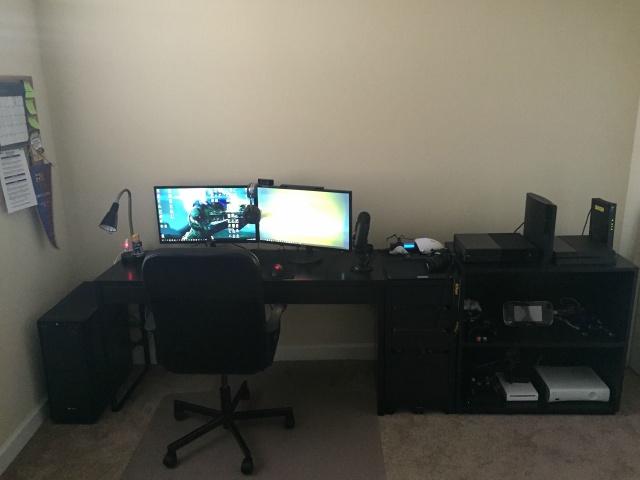
At what (x,y) coordinates should I click in order to perform the action: click on walls. Please return your answer as a coordinate pair (x, y). The height and width of the screenshot is (480, 640). Looking at the image, I should click on (411, 70), (35, 265).